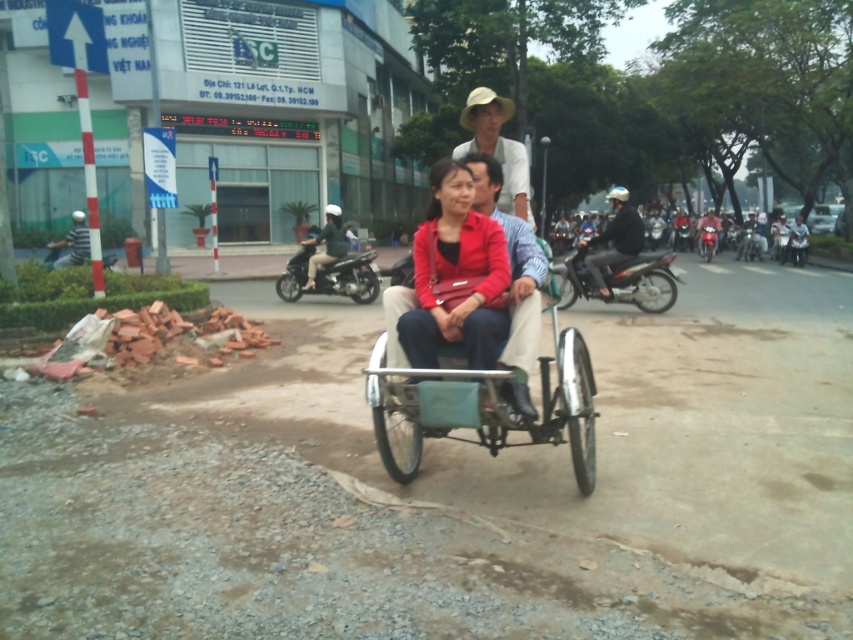
Which is in front, point (525, 198) or point (624, 240)?

Point (525, 198)

Is point (497, 97) positioned before point (627, 216)?

Yes, point (497, 97) is closer to viewer.

Locate an element on the screen. The width and height of the screenshot is (853, 640). natural straw hat at center is located at coordinates [x=497, y=147].

Between dark blue helmet at right and dark blue shirt at center, which one has less height?

With less height is dark blue shirt at center.

Is point (595, 266) positioned behind point (335, 230)?

No, it is not.

Who is more forward, (637, 212) or (341, 236)?

Point (637, 212)

Identify the location of dark blue helmet at right. This screenshot has width=853, height=640. (614, 237).

Can you confirm if matte blue shirt at center is positioned to the left of dark blue helmet at right?

Correct, you'll find matte blue shirt at center to the left of dark blue helmet at right.

Which is more to the left, matte blue shirt at center or dark blue helmet at right?

matte blue shirt at center is more to the left.

The height and width of the screenshot is (640, 853). What do you see at coordinates (512, 262) in the screenshot?
I see `matte blue shirt at center` at bounding box center [512, 262].

You are a GUI agent. You are given a task and a screenshot of the screen. Output one action in this format:
    pyautogui.click(x=<x>, y=<y>)
    Task: Click on the matte blue shirt at center
    The width and height of the screenshot is (853, 640).
    Given the screenshot: What is the action you would take?
    pyautogui.click(x=512, y=262)